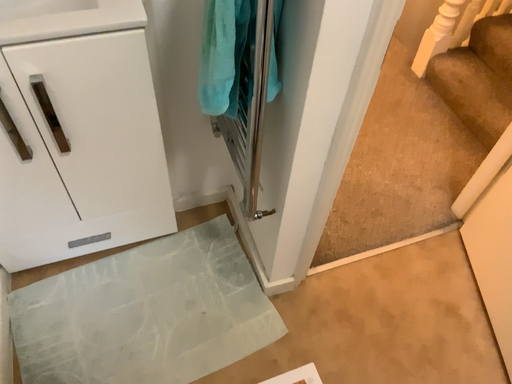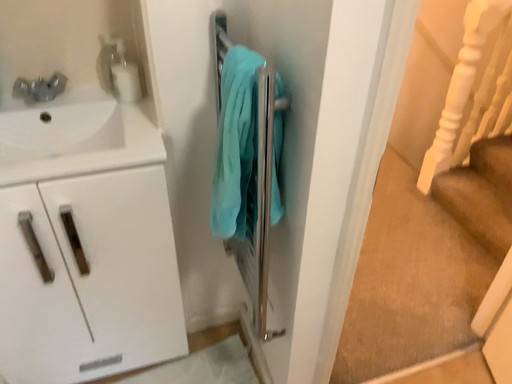
Question: How did the camera likely rotate when shooting the video?

Choices:
 (A) rotated upward
 (B) rotated downward

Answer: (A)